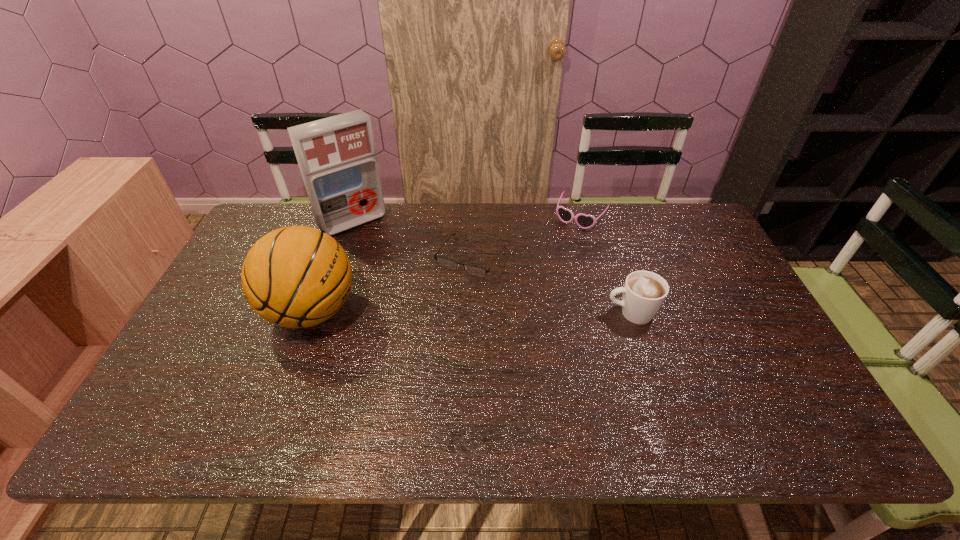
In the image, there is a desktop. Where is `vacant region at the near right corner`? vacant region at the near right corner is located at coordinates (751, 399).

The image size is (960, 540). In order to click on empty space between the cappuccino and the second shortest object in this screenshot , I will do `click(606, 265)`.

You are a GUI agent. You are given a task and a screenshot of the screen. Output one action in this format:
    pyautogui.click(x=<x>, y=<y>)
    Task: Click on the free spot between the sunglasses and the cappuccino
    
    Given the screenshot: What is the action you would take?
    pyautogui.click(x=606, y=265)

The image size is (960, 540). I want to click on free area in between the third tallest object and the fourth tallest object, so click(x=606, y=265).

What are the coordinates of `vacant space in between the shortest object and the first-aid kit` in the screenshot? It's located at (412, 239).

This screenshot has width=960, height=540. Identify the location of unoccupied position between the basketball and the third object from right to left. [x=392, y=284].

Locate which object ranks fourth in proximity to the second shortest object. Please provide its 2D coordinates. Your answer should be formatted as a tuple, i.e. [(x, y)], where the tuple contains the x and y coordinates of a point satisfying the conditions above.

[(297, 276)]

Select which object is the fourth closest to the cappuccino. Please provide its 2D coordinates. Your answer should be formatted as a tuple, i.e. [(x, y)], where the tuple contains the x and y coordinates of a point satisfying the conditions above.

[(337, 158)]

This screenshot has width=960, height=540. I want to click on vacant area that satisfies the following two spatial constraints: 1. on the back side of the second shortest object; 2. on the left side of the third object from left to right, so click(x=471, y=218).

The width and height of the screenshot is (960, 540). Identify the location of vacant space that satisfies the following two spatial constraints: 1. on the front side of the cappuccino; 2. with the handle on the side of the sunglasses. (607, 313).